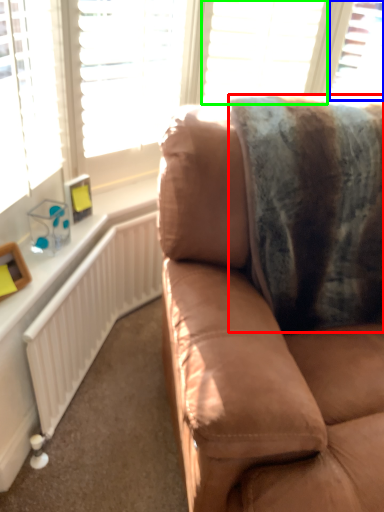
Question: Which is farther away from blanket (highlighted by a red box)? window (highlighted by a blue box) or blind (highlighted by a green box)?

Choices:
 (A) window
 (B) blind

Answer: (A)